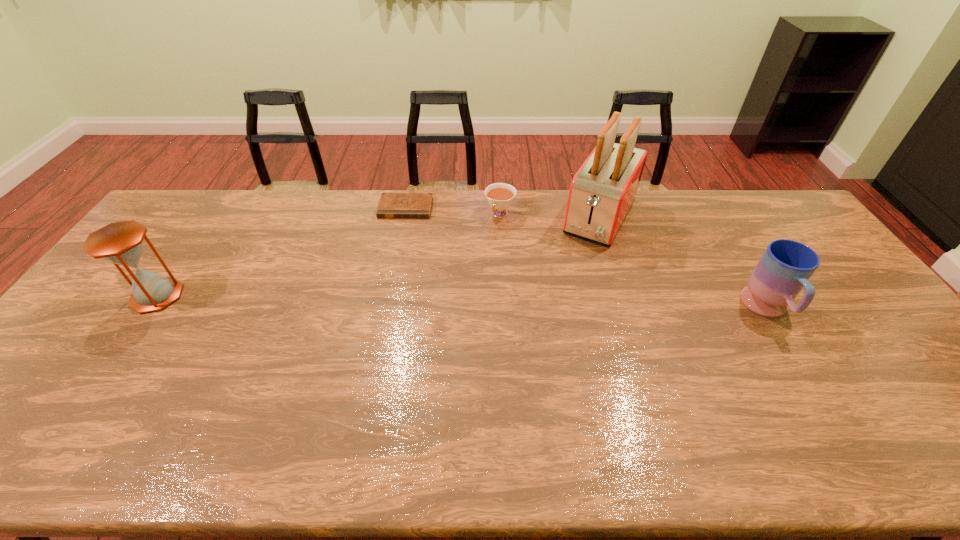
Locate an element on the screen. This screenshot has width=960, height=540. the leftmost object is located at coordinates (120, 243).

Locate an element on the screen. The image size is (960, 540). the second tallest object is located at coordinates pos(120,243).

You are a GUI agent. You are given a task and a screenshot of the screen. Output one action in this format:
    pyautogui.click(x=<x>, y=<y>)
    Task: Click on the mug
    
    Given the screenshot: What is the action you would take?
    pyautogui.click(x=786, y=266)

I want to click on the third tallest object, so click(x=786, y=266).

Where is `the third object from left to right`? The width and height of the screenshot is (960, 540). the third object from left to right is located at coordinates (500, 196).

Where is `the second shortest object`? This screenshot has width=960, height=540. the second shortest object is located at coordinates (500, 196).

Image resolution: width=960 pixels, height=540 pixels. What are the coordinates of `the tallest object` in the screenshot? It's located at (603, 190).

Locate an element on the screen. This screenshot has height=540, width=960. toaster is located at coordinates (603, 190).

Locate an element on the screen. the fourth object from right to left is located at coordinates (391, 205).

At what (x,y) coordinates should I click in order to perform the action: click on diary. Please return your answer as a coordinate pair (x, y). Looking at the image, I should click on (391, 205).